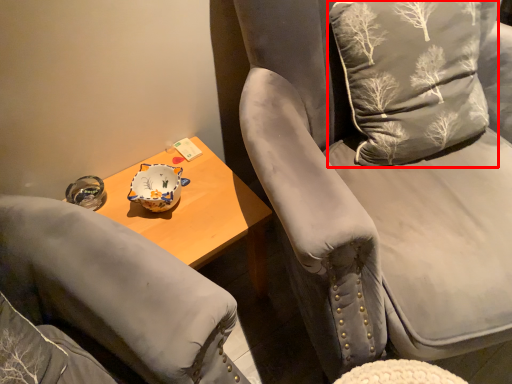
Question: Where is throw pillow (annotated by the red box) located in relation to chair in the image?

Choices:
 (A) right
 (B) left

Answer: (B)